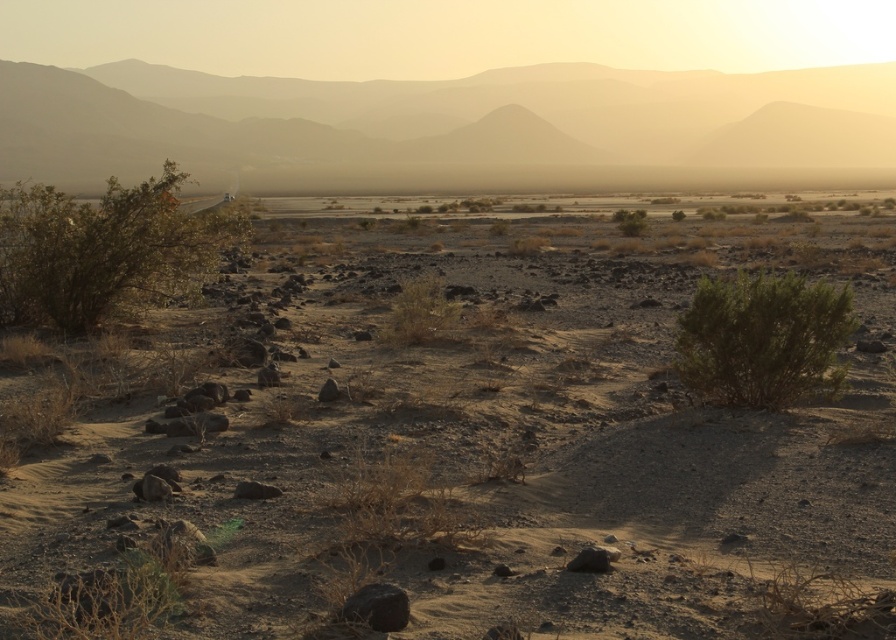
You are a desert explorer who needs to find the largest vegetation in the scene. Which one is larger between the green shrub at left and the green leafy bush at center?

The green shrub at left is bigger than the green leafy bush at center, so the largest vegetation is the green shrub at left.